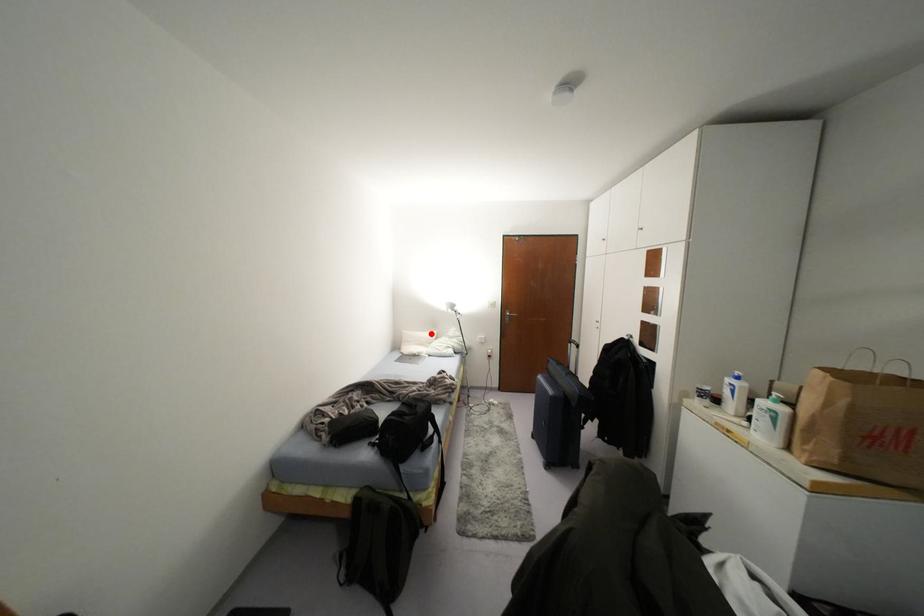
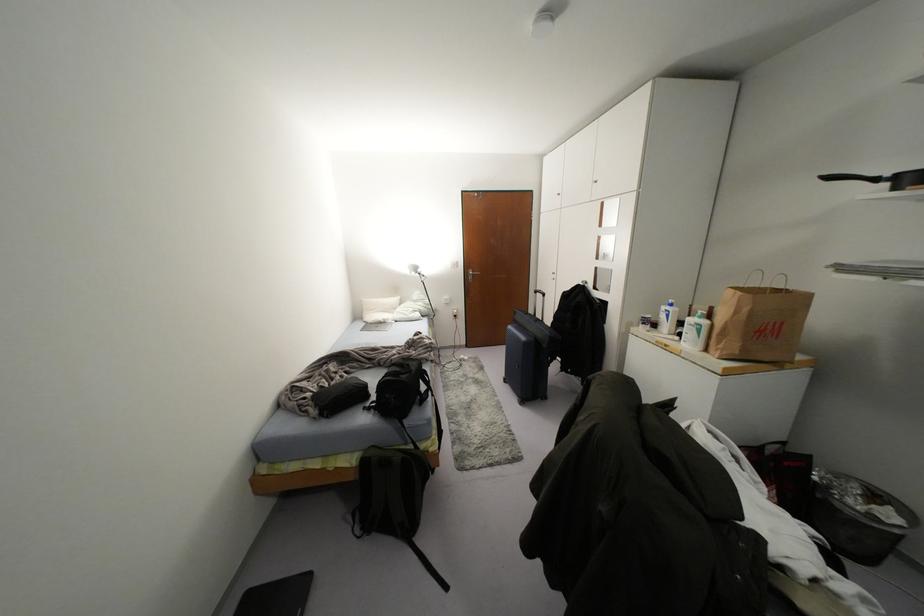
Question: I am providing you with two images of the same scene from different viewpoints. In image1, a red point is highlighted. Considering the same 3D point in image2, which of the following is correct?

Choices:
 (A) It is closer
 (B) It is farther

Answer: (A)